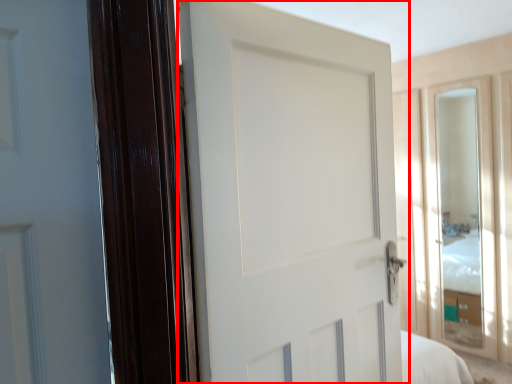
Question: From the image's perspective, what is the correct spatial positioning of door (annotated by the red box) in reference to glass door?

Choices:
 (A) below
 (B) above

Answer: (B)